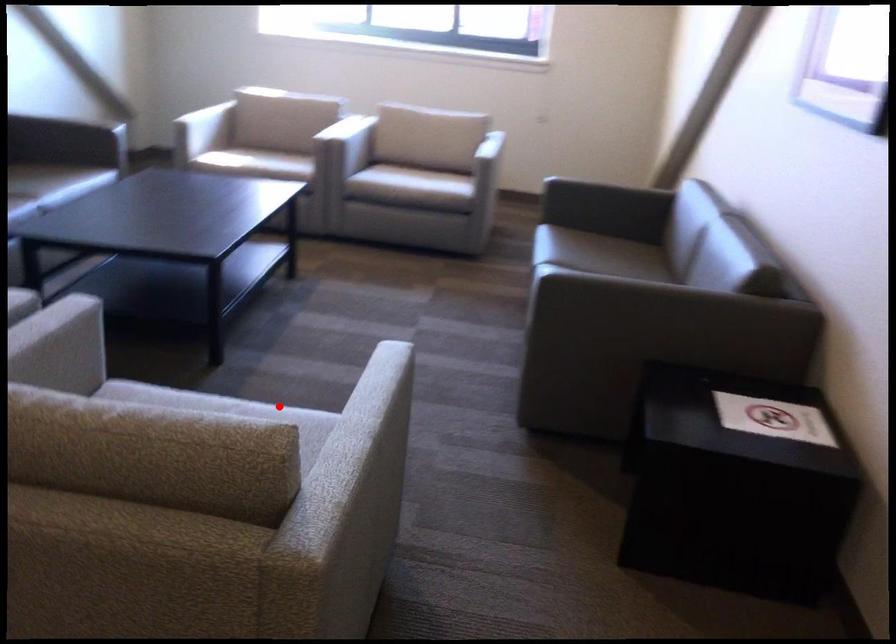
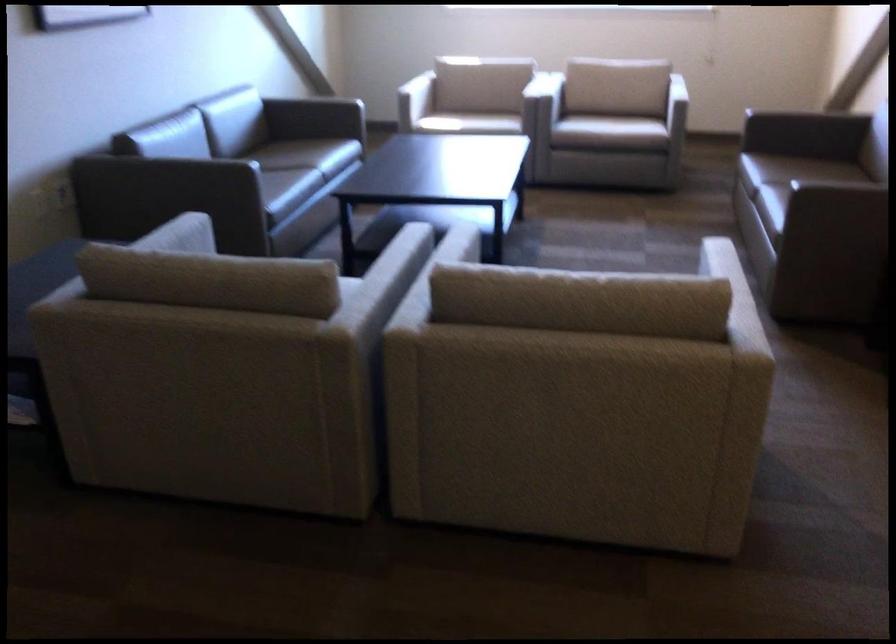
Question: I am providing you with two images of the same scene from different viewpoints. A red point is marked on the first image. At the location where the point appears in image 1, is it still visible in image 2?

Choices:
 (A) Yes
 (B) No

Answer: (B)